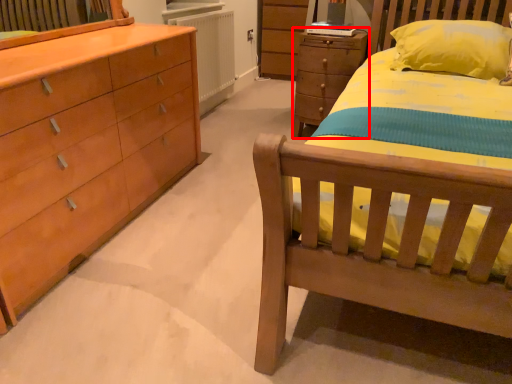
Question: From the image's perspective, what is the correct spatial relationship of chest of drawers (annotated by the red box) in relation to radiator?

Choices:
 (A) below
 (B) above

Answer: (A)